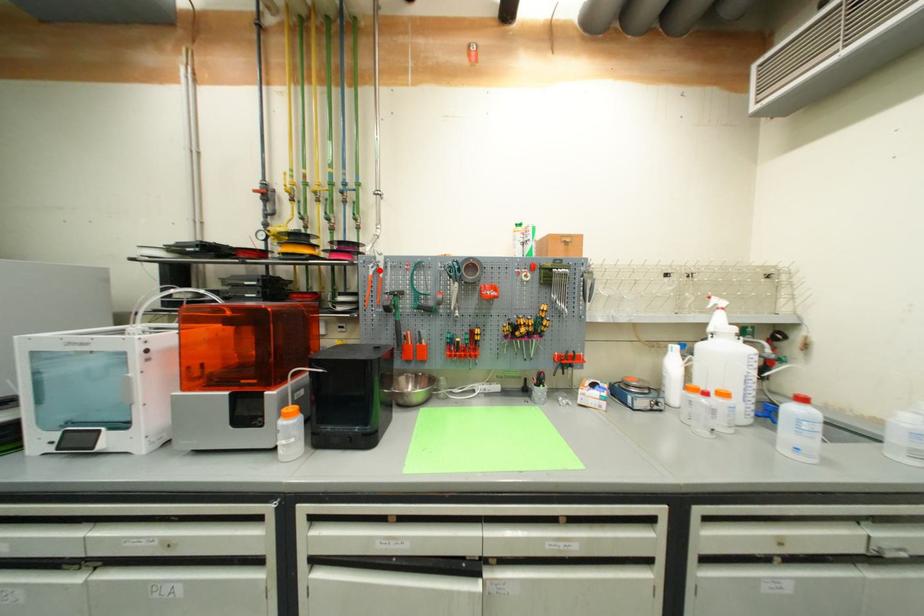
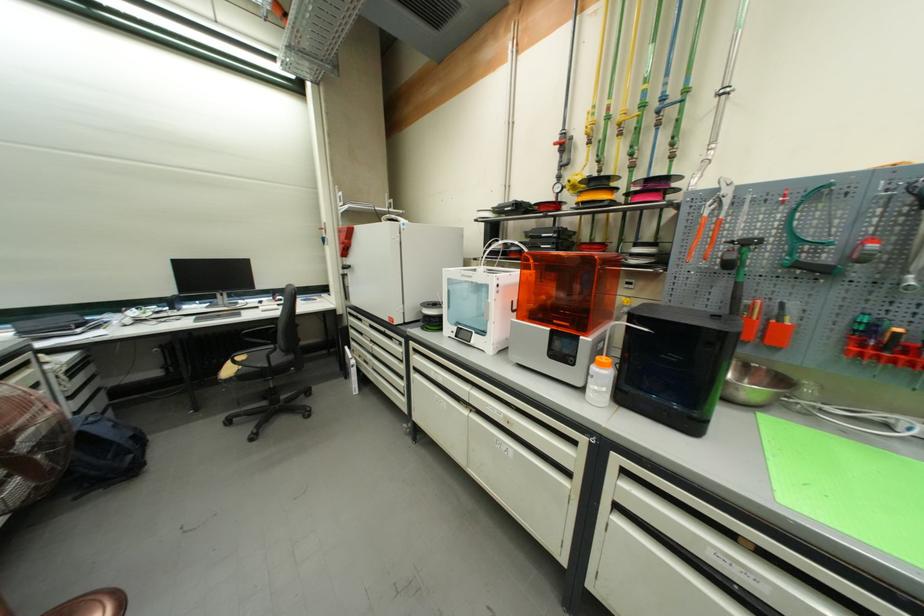
Locate, in the second image, the point that corresponds to the highlighted location in the first image.

(719, 208)